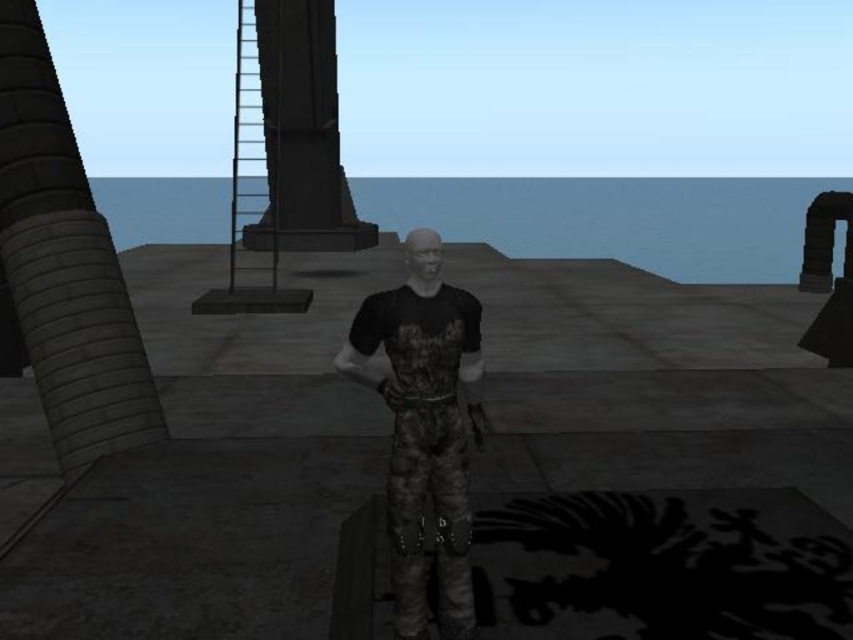
Question: From the image, what is the correct spatial relationship of gray concrete pillar at left in relation to black stone pillar at upper center?

Choices:
 (A) below
 (B) above

Answer: (A)

Question: Which of the following is the farthest from the observer?

Choices:
 (A) black stone pillar at upper center
 (B) gray concrete pillar at left

Answer: (A)

Question: Estimate the real-world distances between objects in this image. Which object is closer to the gray concrete pillar at left?

Choices:
 (A) camouflage pants at center
 (B) black stone pillar at upper center

Answer: (A)

Question: Does gray concrete pillar at left come behind black stone pillar at upper center?

Choices:
 (A) yes
 (B) no

Answer: (B)

Question: Is gray concrete pillar at left closer to camera compared to camouflage pants at center?

Choices:
 (A) no
 (B) yes

Answer: (A)

Question: Estimate the real-world distances between objects in this image. Which object is closer to the gray concrete pillar at left?

Choices:
 (A) black stone pillar at upper center
 (B) camouflage pants at center

Answer: (B)